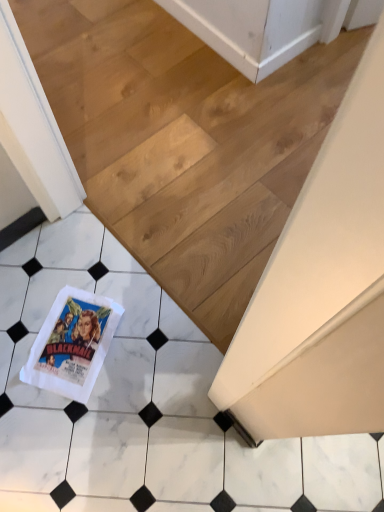
This screenshot has width=384, height=512. Find the location of `blank space above white marble tile at lower left (from a real-world perspective)`. blank space above white marble tile at lower left (from a real-world perspective) is located at coordinates (173, 313).